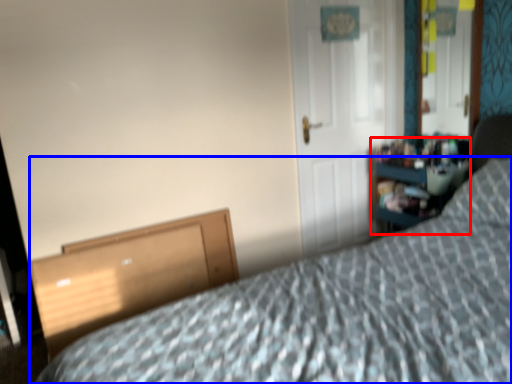
Question: Which object appears farthest to the camera in this image, dresser (highlighted by a red box) or bed (highlighted by a blue box)?

Choices:
 (A) dresser
 (B) bed

Answer: (A)